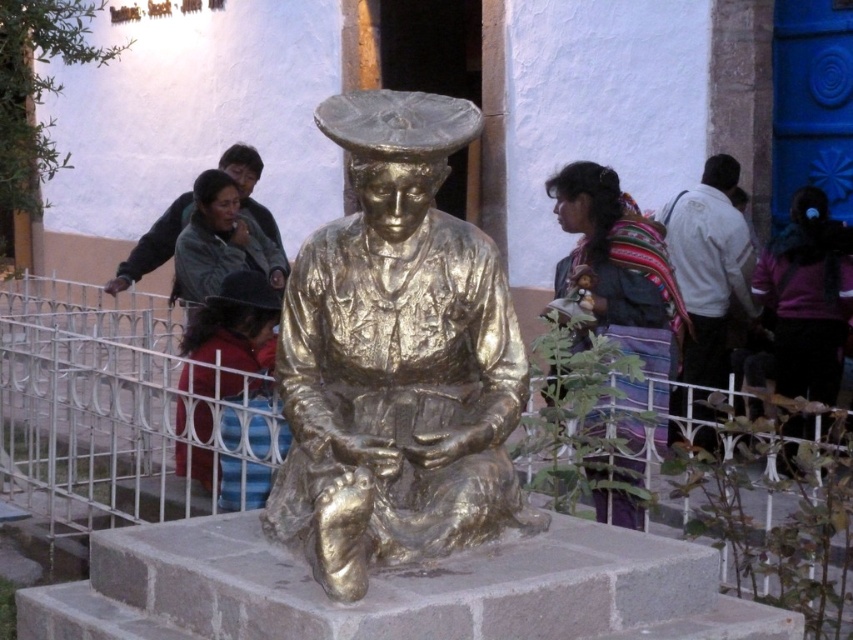
Question: Which of the following is the closest to the observer?

Choices:
 (A) gold-bronze statue at center
 (B) multicolored woven fabric at right
 (C) white cotton shirt at right
 (D) red fabric pants at lower left

Answer: (A)

Question: Can you confirm if multicolored woven fabric at right is positioned below white cotton shirt at right?

Choices:
 (A) no
 (B) yes

Answer: (B)

Question: Is red fabric pants at lower left smaller than matte green jacket at upper left?

Choices:
 (A) no
 (B) yes

Answer: (A)

Question: Can you confirm if multicolored woven fabric at right is positioned to the right of white cotton shirt at right?

Choices:
 (A) no
 (B) yes

Answer: (A)

Question: Which object is farther from the camera taking this photo?

Choices:
 (A) matte green jacket at upper left
 (B) multicolored woven fabric at right

Answer: (A)

Question: Which object appears farthest from the camera in this image?

Choices:
 (A) white cotton shirt at right
 (B) red fabric pants at lower left
 (C) gold-bronze statue at center

Answer: (A)